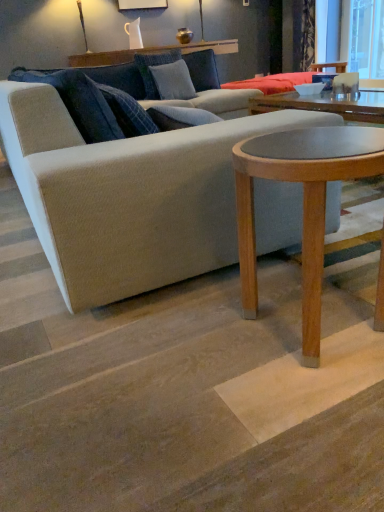
Question: From the image's perspective, is textured blue pillow at upper center, arranged as the 1th pillow when viewed from the back, beneath velvet dark blue curtain at upper right?

Choices:
 (A) no
 (B) yes

Answer: (B)

Question: Can you confirm if textured blue pillow at upper center, arranged as the 1th pillow when viewed from the back, is shorter than velvet dark blue curtain at upper right?

Choices:
 (A) no
 (B) yes

Answer: (B)

Question: Does textured blue pillow at upper center, the 2th pillow when ordered from front to back, contain velvet dark blue curtain at upper right?

Choices:
 (A) no
 (B) yes

Answer: (A)

Question: Is textured blue pillow at upper center, the 2th pillow when ordered from front to back, closer to the viewer compared to velvet dark blue curtain at upper right?

Choices:
 (A) no
 (B) yes

Answer: (B)

Question: Is the depth of textured blue pillow at upper center, the 2th pillow when ordered from front to back, greater than that of velvet dark blue curtain at upper right?

Choices:
 (A) yes
 (B) no

Answer: (B)

Question: Is textured blue pillow at upper center, the 2th pillow when ordered from front to back, spatially inside velvet dark blue curtain at upper right, or outside of it?

Choices:
 (A) outside
 (B) inside

Answer: (A)

Question: Is point [155, 93] closer or farther from the camera than point [301, 44]?

Choices:
 (A) farther
 (B) closer

Answer: (B)

Question: Is textured blue pillow at upper center, arranged as the 1th pillow when viewed from the back, to the left or to the right of velvet dark blue curtain at upper right in the image?

Choices:
 (A) right
 (B) left

Answer: (B)

Question: From their relative heights in the image, would you say textured blue pillow at upper center, the 2th pillow when ordered from front to back, is taller or shorter than velvet dark blue curtain at upper right?

Choices:
 (A) tall
 (B) short

Answer: (B)

Question: Would you say velvet dark blue curtain at upper right is inside or outside transparent glass window screen at upper right?

Choices:
 (A) outside
 (B) inside

Answer: (A)

Question: From a real-world perspective, is velvet dark blue curtain at upper right above or below transparent glass window screen at upper right?

Choices:
 (A) below
 (B) above

Answer: (B)

Question: From the image's perspective, is velvet dark blue curtain at upper right above or below transparent glass window screen at upper right?

Choices:
 (A) below
 (B) above

Answer: (B)

Question: Is velvet dark blue curtain at upper right to the left or to the right of transparent glass window screen at upper right in the image?

Choices:
 (A) right
 (B) left

Answer: (B)

Question: Based on their positions, is light brown wood coffee table at center located to the left or right of transparent glass window screen at upper right?

Choices:
 (A) left
 (B) right

Answer: (A)

Question: Considering their positions, is light brown wood coffee table at center located in front of or behind transparent glass window screen at upper right?

Choices:
 (A) front
 (B) behind

Answer: (A)